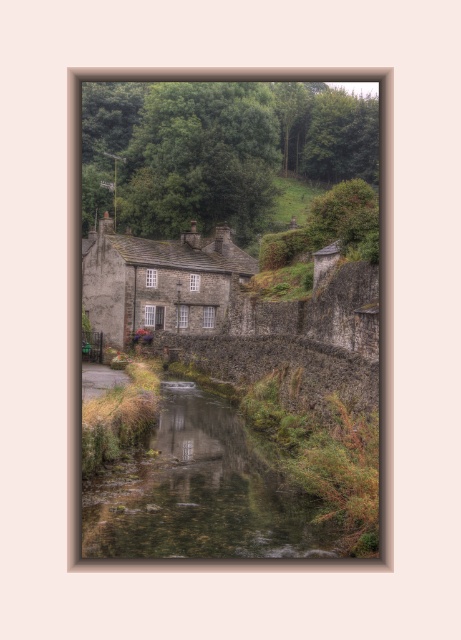
Who is positioned more to the left, clear water stream at center or rustic stone cottage at center?

rustic stone cottage at center

Does point (139, 554) lie in front of point (164, 320)?

Yes, it is in front of point (164, 320).

Between point (195, 465) and point (110, 330), which one is positioned behind?

Positioned behind is point (110, 330).

Locate an element on the screen. The height and width of the screenshot is (640, 461). clear water stream at center is located at coordinates (198, 492).